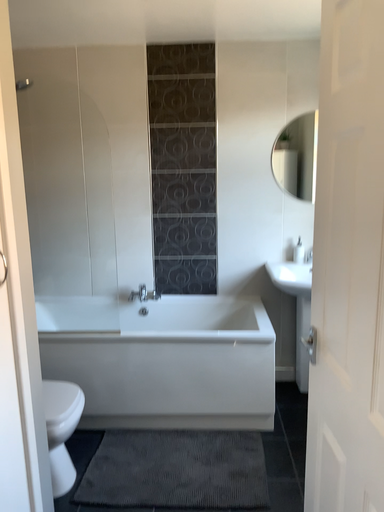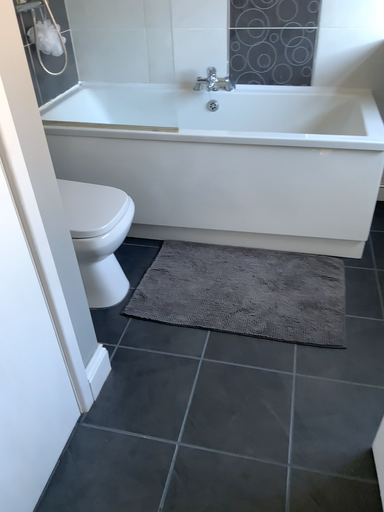
Question: Which way did the camera rotate in the video?

Choices:
 (A) rotated left
 (B) rotated right

Answer: (A)